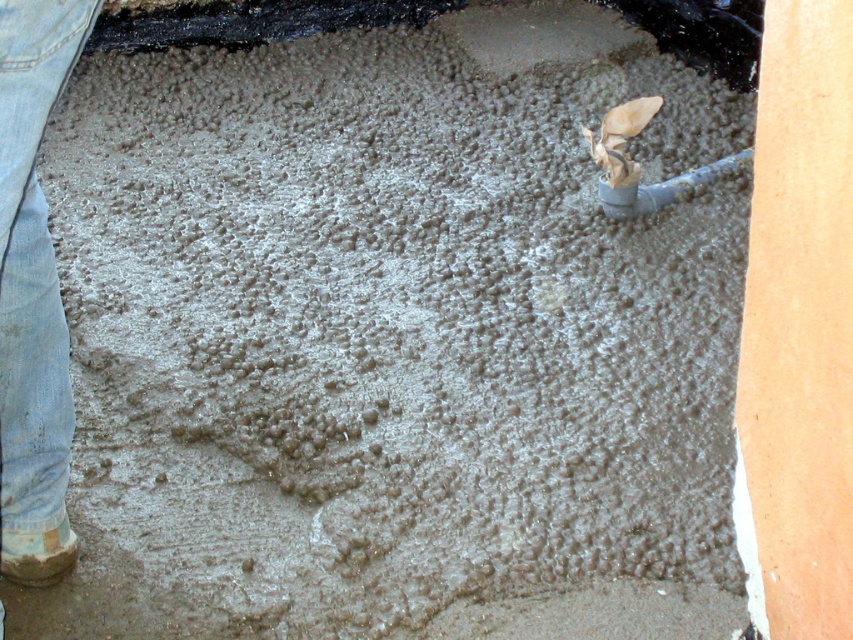
Between denim jeans at lower left and brown fur chihuahua at upper center, which one is positioned lower?

denim jeans at lower left is below.

Looking at this image, how far apart are denim jeans at lower left and brown fur chihuahua at upper center?

4.61 feet

Who is more forward, (28, 122) or (614, 157)?

Point (28, 122)

This screenshot has width=853, height=640. What are the coordinates of `denim jeans at lower left` in the screenshot? It's located at (33, 292).